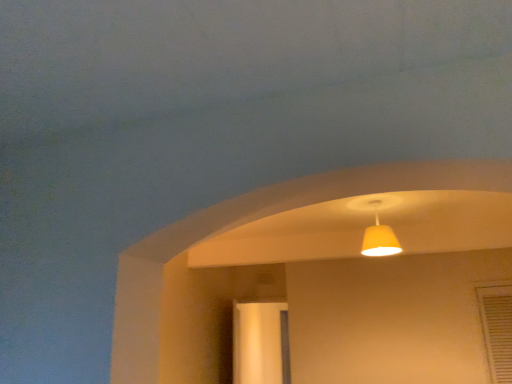
Question: Is matte yellow lampshade at upper center to the right of clear glass screen door at center from the viewer's perspective?

Choices:
 (A) yes
 (B) no

Answer: (A)

Question: Is clear glass screen door at center a part of matte yellow lampshade at upper center?

Choices:
 (A) yes
 (B) no

Answer: (B)

Question: Is matte yellow lampshade at upper center closer to camera compared to clear glass screen door at center?

Choices:
 (A) no
 (B) yes

Answer: (B)

Question: Is matte yellow lampshade at upper center not close to clear glass screen door at center?

Choices:
 (A) yes
 (B) no

Answer: (A)

Question: From a real-world perspective, is matte yellow lampshade at upper center located beneath clear glass screen door at center?

Choices:
 (A) yes
 (B) no

Answer: (B)

Question: Is matte yellow lampshade at upper center outside clear glass screen door at center?

Choices:
 (A) yes
 (B) no

Answer: (A)

Question: Is matte yellow lampshade at upper center inside clear glass screen door at center?

Choices:
 (A) yes
 (B) no

Answer: (B)

Question: From a real-world perspective, is clear glass screen door at center located beneath matte yellow lampshade at upper center?

Choices:
 (A) yes
 (B) no

Answer: (A)

Question: Is clear glass screen door at center located outside matte yellow lampshade at upper center?

Choices:
 (A) yes
 (B) no

Answer: (A)

Question: Is clear glass screen door at center to the left of matte yellow lampshade at upper center from the viewer's perspective?

Choices:
 (A) yes
 (B) no

Answer: (A)

Question: Can you confirm if clear glass screen door at center is positioned to the right of matte yellow lampshade at upper center?

Choices:
 (A) yes
 (B) no

Answer: (B)

Question: Is clear glass screen door at center behind matte yellow lampshade at upper center?

Choices:
 (A) yes
 (B) no

Answer: (A)

Question: Choose the correct answer: Is matte yellow lampshade at upper center inside clear glass screen door at center or outside it?

Choices:
 (A) inside
 (B) outside

Answer: (B)